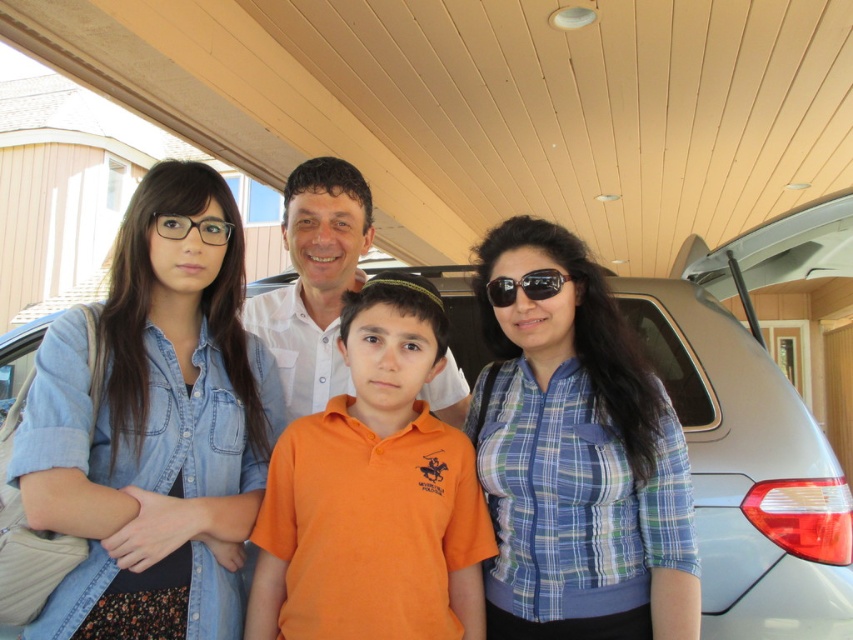
Question: Is sunglasses at center further to camera compared to clear plastic glasses at upper left?

Choices:
 (A) yes
 (B) no

Answer: (A)

Question: Which object is positioned farthest from the clear plastic glasses at upper left?

Choices:
 (A) white cotton shirt at center
 (B) orange cotton shirt at center

Answer: (B)

Question: Is white cotton shirt at center bigger than sunglasses at center?

Choices:
 (A) yes
 (B) no

Answer: (A)

Question: Which of the following is the farthest from the observer?

Choices:
 (A) (170, 221)
 (B) (350, 316)

Answer: (B)

Question: Can you confirm if white cotton shirt at center is wider than sunglasses at center?

Choices:
 (A) yes
 (B) no

Answer: (A)

Question: Which point is farther to the camera?

Choices:
 (A) satin silver car at center
 (B) sunglasses at center

Answer: (A)